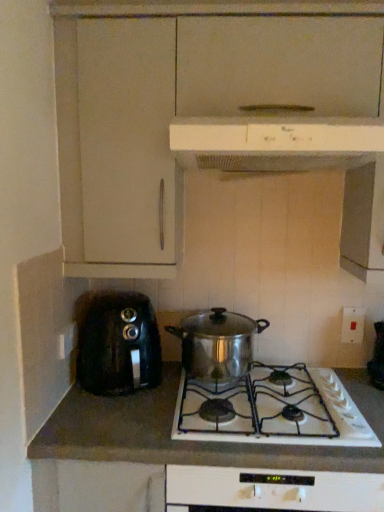
The height and width of the screenshot is (512, 384). Describe the element at coordinates (186, 442) in the screenshot. I see `white glossy stove at center` at that location.

This screenshot has height=512, width=384. Describe the element at coordinates (352, 325) in the screenshot. I see `white plastic switch at right, arranged as the 1th electric outlet when viewed from the back` at that location.

Locate an element on the screen. This screenshot has height=512, width=384. black plastic toaster at left is located at coordinates (118, 344).

In order to click on white plastic electric outlet at lower right, which is counted as the first electric outlet, starting from the front in this screenshot , I will do `click(66, 341)`.

Which of these two, shiny silver gas stove at center or white plastic range hood at upper center, the second kitchen appliance in the bottom-to-top sequence, is thinner?

With smaller width is white plastic range hood at upper center, the second kitchen appliance in the bottom-to-top sequence.

Is point (293, 373) closer or farther from the camera than point (339, 145)?

Point (293, 373).

From the image's perspective, which is below, shiny silver gas stove at center or white plastic range hood at upper center, the second kitchen appliance in the bottom-to-top sequence?

shiny silver gas stove at center.

Looking at this image, can you confirm if black plastic toaster at left is bigger than white plastic electric outlet at lower right, the 2th electric outlet viewed from the right?

Indeed, black plastic toaster at left has a larger size compared to white plastic electric outlet at lower right, the 2th electric outlet viewed from the right.

From a real-world perspective, is black plastic toaster at left on white plastic electric outlet at lower right, which is counted as the first electric outlet, starting from the front?

Actually, black plastic toaster at left is physically below white plastic electric outlet at lower right, which is counted as the first electric outlet, starting from the front, in the real world.

Would you say white plastic electric outlet at lower right, which is the 1th electric outlet from left to right, is part of black plastic toaster at left's contents?

No, white plastic electric outlet at lower right, which is the 1th electric outlet from left to right, is not inside black plastic toaster at left.

Is stainless steel pot at center, positioned as the second kitchen appliance in top-to-bottom order, smaller than white plastic range hood at upper center, arranged as the 1th kitchen appliance when viewed from the top?

Indeed, stainless steel pot at center, positioned as the second kitchen appliance in top-to-bottom order, has a smaller size compared to white plastic range hood at upper center, arranged as the 1th kitchen appliance when viewed from the top.

I want to click on kitchen appliance on the left of the white plastic range hood at upper center, the second kitchen appliance in the bottom-to-top sequence, so click(x=217, y=343).

Which is less distant, (250, 333) or (318, 135)?

The point (318, 135) is closer.

Is point (193, 125) farther from viewer compared to point (93, 375)?

No, it is in front of (93, 375).

In the image, is white plastic range hood at upper center, arranged as the 1th kitchen appliance when viewed from the top, positioned in front of or behind black plastic toaster at left?

white plastic range hood at upper center, arranged as the 1th kitchen appliance when viewed from the top, is positioned closer to the viewer than black plastic toaster at left.

Based on the photo, considering the relative sizes of white plastic range hood at upper center, the second kitchen appliance in the bottom-to-top sequence, and black plastic toaster at left in the image provided, is white plastic range hood at upper center, the second kitchen appliance in the bottom-to-top sequence, smaller than black plastic toaster at left?

Incorrect, white plastic range hood at upper center, the second kitchen appliance in the bottom-to-top sequence, is not smaller in size than black plastic toaster at left.

From the image's perspective, who appears lower, white plastic range hood at upper center, arranged as the 1th kitchen appliance when viewed from the top, or black plastic toaster at left?

black plastic toaster at left, from the image's perspective.

Considering the relative sizes of stainless steel pot at center, positioned as the second kitchen appliance in top-to-bottom order, and white glossy stove at center in the image provided, is stainless steel pot at center, positioned as the second kitchen appliance in top-to-bottom order, wider than white glossy stove at center?

No, stainless steel pot at center, positioned as the second kitchen appliance in top-to-bottom order, is not wider than white glossy stove at center.

How many degrees apart are the facing directions of stainless steel pot at center, positioned as the second kitchen appliance in top-to-bottom order, and white glossy stove at center?

There is a 1.08-degree angle between the facing directions of stainless steel pot at center, positioned as the second kitchen appliance in top-to-bottom order, and white glossy stove at center.

In the scene shown: Which is more distant, (211, 381) or (352, 454)?

The point (211, 381) is farther from the camera.

Who is more distant, stainless steel pot at center, positioned as the second kitchen appliance in top-to-bottom order, or white plastic electric outlet at lower right, the 2th electric outlet viewed from the right?

white plastic electric outlet at lower right, the 2th electric outlet viewed from the right, is more distant.

How many degrees apart are the facing directions of stainless steel pot at center, positioned as the second kitchen appliance in top-to-bottom order, and white plastic electric outlet at lower right, which is the second electric outlet from back to front?

They differ by 89.6 degrees in their facing directions.

Is stainless steel pot at center, placed as the first kitchen appliance when sorted from bottom to top, completely or partially outside of white plastic electric outlet at lower right, which is the second electric outlet from back to front?

Yes, stainless steel pot at center, placed as the first kitchen appliance when sorted from bottom to top, is not within white plastic electric outlet at lower right, which is the second electric outlet from back to front.

Between stainless steel pot at center, placed as the first kitchen appliance when sorted from bottom to top, and white plastic electric outlet at lower right, which is the 1th electric outlet from left to right, which one appears on the left side from the viewer's perspective?

Positioned to the left is white plastic electric outlet at lower right, which is the 1th electric outlet from left to right.

This screenshot has width=384, height=512. I want to click on kitchen appliance to the left of white plastic range hood at upper center, arranged as the 1th kitchen appliance when viewed from the top, so click(217, 343).

Can you confirm if white plastic range hood at upper center, arranged as the 1th kitchen appliance when viewed from the top, is wider than stainless steel pot at center, placed as the first kitchen appliance when sorted from bottom to top?

Yes.

Based on their positions, is white plastic range hood at upper center, the second kitchen appliance in the bottom-to-top sequence, located to the left or right of stainless steel pot at center, placed as the first kitchen appliance when sorted from bottom to top?

Based on their positions, white plastic range hood at upper center, the second kitchen appliance in the bottom-to-top sequence, is located to the right of stainless steel pot at center, placed as the first kitchen appliance when sorted from bottom to top.

Can you tell me how much white plastic range hood at upper center, the second kitchen appliance in the bottom-to-top sequence, and stainless steel pot at center, positioned as the second kitchen appliance in top-to-bottom order, differ in facing direction?

0.489 degrees separate the facing orientations of white plastic range hood at upper center, the second kitchen appliance in the bottom-to-top sequence, and stainless steel pot at center, positioned as the second kitchen appliance in top-to-bottom order.

Image resolution: width=384 pixels, height=512 pixels. I want to click on gas stove that is behind the white plastic range hood at upper center, the second kitchen appliance in the bottom-to-top sequence, so click(272, 410).

Where is `toaster located below the white plastic electric outlet at lower right, which is counted as the first electric outlet, starting from the front (from the image's perspective)`? toaster located below the white plastic electric outlet at lower right, which is counted as the first electric outlet, starting from the front (from the image's perspective) is located at coordinates (x=118, y=344).

Which object lies further to the anchor point white glossy stove at center, shiny silver gas stove at center or black plastic toaster at left?

The object further to white glossy stove at center is black plastic toaster at left.

Estimate the real-world distances between objects in this image. Which object is further from white plastic range hood at upper center, the second kitchen appliance in the bottom-to-top sequence, stainless steel pot at center, placed as the first kitchen appliance when sorted from bottom to top, or black plastic toaster at left?

black plastic toaster at left lies further to white plastic range hood at upper center, the second kitchen appliance in the bottom-to-top sequence, than the other object.

In the scene shown: From the image, which object appears to be farther from black plastic toaster at left, white glossy stove at center or white plastic range hood at upper center, the second kitchen appliance in the bottom-to-top sequence?

Among the two, white plastic range hood at upper center, the second kitchen appliance in the bottom-to-top sequence, is located further to black plastic toaster at left.

From the image, which object appears to be farther from white plastic electric outlet at lower right, which is the 1th electric outlet from left to right, shiny silver gas stove at center or white plastic switch at right, the first electric outlet in the right-to-left sequence?

The object further to white plastic electric outlet at lower right, which is the 1th electric outlet from left to right, is white plastic switch at right, the first electric outlet in the right-to-left sequence.

From the image, which object appears to be farther from white glossy stove at center, white plastic range hood at upper center, arranged as the 1th kitchen appliance when viewed from the top, or shiny silver gas stove at center?

Among the two, white plastic range hood at upper center, arranged as the 1th kitchen appliance when viewed from the top, is located further to white glossy stove at center.

Based on their spatial positions, is white plastic range hood at upper center, the second kitchen appliance in the bottom-to-top sequence, or white plastic switch at right, which appears as the second electric outlet when viewed from the left, closer to black plastic toaster at left?

white plastic range hood at upper center, the second kitchen appliance in the bottom-to-top sequence, is positioned closer to the anchor black plastic toaster at left.

Which object lies further to the anchor point white plastic electric outlet at lower right, which is the 1th electric outlet from left to right, white plastic switch at right, the 2th electric outlet viewed from the front, or shiny silver gas stove at center?

The object further to white plastic electric outlet at lower right, which is the 1th electric outlet from left to right, is white plastic switch at right, the 2th electric outlet viewed from the front.

When comparing their distances from white glossy stove at center, does white plastic range hood at upper center, arranged as the 1th kitchen appliance when viewed from the top, or white plastic electric outlet at lower right, which is counted as the first electric outlet, starting from the front, seem further?

Based on the image, white plastic range hood at upper center, arranged as the 1th kitchen appliance when viewed from the top, appears to be further to white glossy stove at center.

Where is `gas stove positioned between white glossy stove at center and white plastic switch at right, which appears as the second electric outlet when viewed from the left, from near to far`? gas stove positioned between white glossy stove at center and white plastic switch at right, which appears as the second electric outlet when viewed from the left, from near to far is located at coordinates (272, 410).

I want to click on gas stove between stainless steel pot at center, placed as the first kitchen appliance when sorted from bottom to top, and white plastic switch at right, the first electric outlet in the right-to-left sequence, so click(272, 410).

You are a GUI agent. You are given a task and a screenshot of the screen. Output one action in this format:
    pyautogui.click(x=<x>, y=<y>)
    Task: Click on the kitchen appliance located between black plastic toaster at left and shiny silver gas stove at center in the left-right direction
    The width and height of the screenshot is (384, 512).
    Given the screenshot: What is the action you would take?
    pyautogui.click(x=217, y=343)

Find the location of a particular element. Image resolution: width=384 pixels, height=512 pixels. gas stove that lies between white plastic range hood at upper center, the second kitchen appliance in the bottom-to-top sequence, and white glossy stove at center from top to bottom is located at coordinates (272, 410).